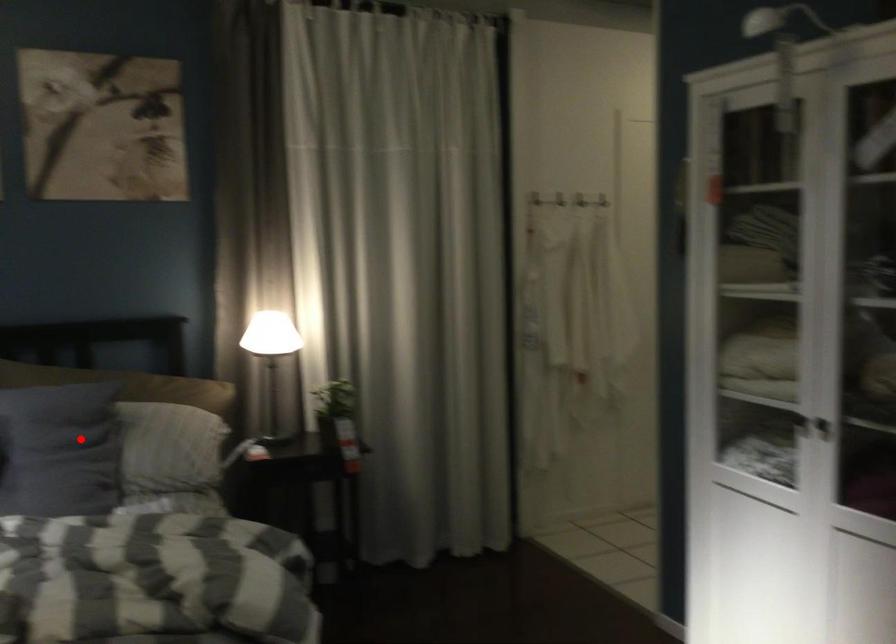
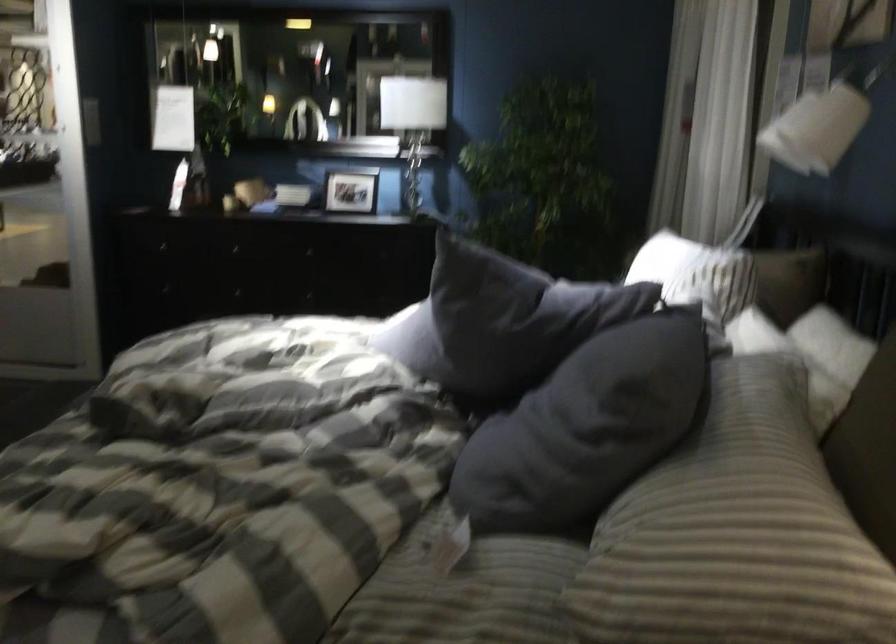
Locate, in the second image, the point that corresponds to the highlighted location in the first image.

(596, 415)